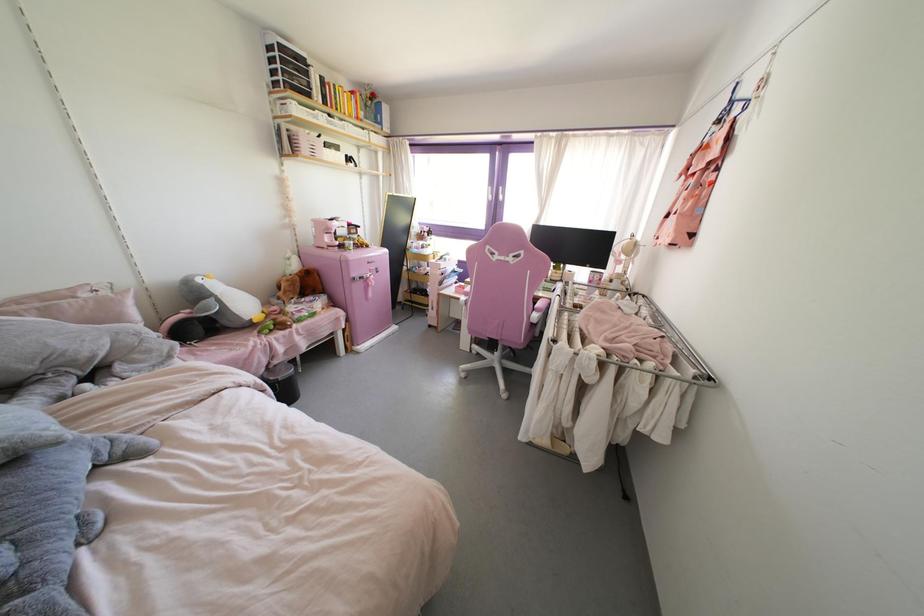
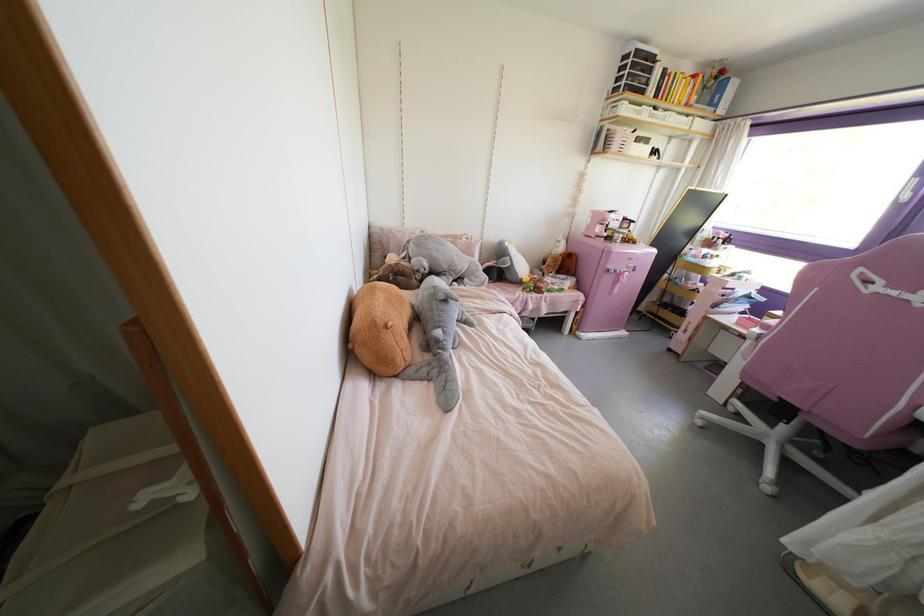
Locate, in the second image, the point that corresponds to point 377,272 in the first image.

(633, 270)